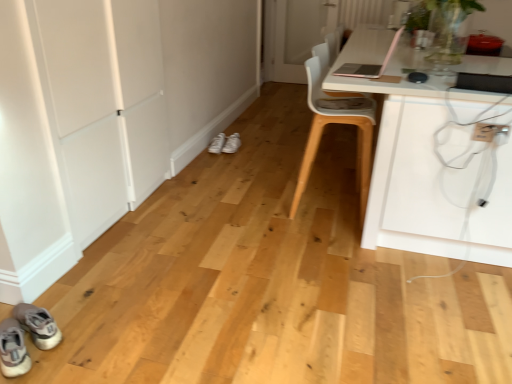
Question: Considering the relative sizes of white plastic electric outlet at lower right and white matte door at left, marked as the first door in a left-to-right arrangement, in the image provided, is white plastic electric outlet at lower right taller than white matte door at left, marked as the first door in a left-to-right arrangement,?

Choices:
 (A) yes
 (B) no

Answer: (B)

Question: Is white plastic electric outlet at lower right thinner than white matte door at left, which appears as the 2th door when viewed from the right?

Choices:
 (A) no
 (B) yes

Answer: (B)

Question: Would you say white plastic electric outlet at lower right is a long distance from white matte door at left, arranged as the 2th door when viewed from the top?

Choices:
 (A) no
 (B) yes

Answer: (B)

Question: Considering the relative sizes of white plastic electric outlet at lower right and white matte door at left, the second door from the back, in the image provided, is white plastic electric outlet at lower right smaller than white matte door at left, the second door from the back,?

Choices:
 (A) yes
 (B) no

Answer: (A)

Question: Can you see white plastic electric outlet at lower right touching white matte door at left, the first door from the bottom?

Choices:
 (A) yes
 (B) no

Answer: (B)

Question: In terms of width, does white glass door at center, the first door when ordered from back to front, look wider or thinner when compared to white plastic electric outlet at lower right?

Choices:
 (A) wide
 (B) thin

Answer: (A)

Question: Based on their positions, is white glass door at center, which is the second door from bottom to top, located to the left or right of white plastic electric outlet at lower right?

Choices:
 (A) left
 (B) right

Answer: (A)

Question: Considering the positions of point (327, 24) and point (494, 127), is point (327, 24) closer or farther from the camera than point (494, 127)?

Choices:
 (A) farther
 (B) closer

Answer: (A)

Question: From the image's perspective, is white glass door at center, which is the first door in top-to-bottom order, above or below white plastic electric outlet at lower right?

Choices:
 (A) below
 (B) above

Answer: (B)

Question: Considering their positions, is white glass door at center, placed as the 2th door when sorted from front to back, located in front of or behind white matte door at left, the first door from the bottom?

Choices:
 (A) front
 (B) behind

Answer: (B)

Question: From the image's perspective, is white glass door at center, placed as the 2th door when sorted from front to back, above or below white matte door at left, marked as the first door in a left-to-right arrangement?

Choices:
 (A) above
 (B) below

Answer: (A)

Question: Which is correct: white glass door at center, the first door when ordered from back to front, is inside white matte door at left, arranged as the 2th door when viewed from the top, or outside of it?

Choices:
 (A) inside
 (B) outside

Answer: (B)

Question: Would you say white glass door at center, placed as the 2th door when sorted from front to back, is to the left or to the right of white matte door at left, which appears as the 2th door when viewed from the right, in the picture?

Choices:
 (A) left
 (B) right

Answer: (B)

Question: In the image, is white matte door at left, the 1th door in the front-to-back sequence, on the left side or the right side of pink matte laptop at upper right?

Choices:
 (A) right
 (B) left

Answer: (B)

Question: Do you think white matte door at left, arranged as the 2th door when viewed from the top, is within pink matte laptop at upper right, or outside of it?

Choices:
 (A) inside
 (B) outside

Answer: (B)